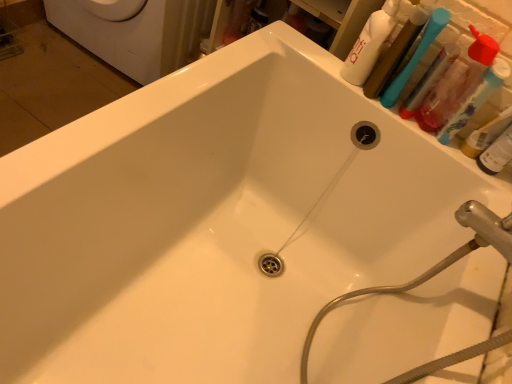
Image resolution: width=512 pixels, height=384 pixels. Describe the element at coordinates (496, 154) in the screenshot. I see `translucent plastic bottle at upper right` at that location.

Measure the distance between translucent plastic bottle at upper right and camera.

translucent plastic bottle at upper right and camera are 34.65 inches apart.

Describe the element at coordinates (369, 44) in the screenshot. I see `white glossy bottle at upper right` at that location.

This screenshot has width=512, height=384. Find the location of `white glossy washing machine at upper left`. white glossy washing machine at upper left is located at coordinates (136, 32).

Identify the location of translucent plastic bottle at upper right. This screenshot has width=512, height=384. (496, 154).

Consider the image. Is blue plastic toothbrush at upper right, which is the 1th toothbrush from right to left, touching brushed metal hose at upper right?

No, blue plastic toothbrush at upper right, which is the 1th toothbrush from right to left, is not next to brushed metal hose at upper right.

How much distance is there between blue plastic toothbrush at upper right, which is the 1th toothbrush from right to left, and brushed metal hose at upper right?

blue plastic toothbrush at upper right, which is the 1th toothbrush from right to left, is 15.20 inches away from brushed metal hose at upper right.

Could you tell me if blue plastic toothbrush at upper right, which is the 1th toothbrush from right to left, is facing brushed metal hose at upper right?

No, blue plastic toothbrush at upper right, which is the 1th toothbrush from right to left, is not aimed at brushed metal hose at upper right.

Can you confirm if blue plastic toothbrush at upper right, which ranks as the 2th toothbrush in left-to-right order, is thinner than brushed metal hose at upper right?

Yes, blue plastic toothbrush at upper right, which ranks as the 2th toothbrush in left-to-right order, is thinner than brushed metal hose at upper right.

Where is `plumbing fixture below the translucent plastic bottle at upper right (from the image's perspective)`? The width and height of the screenshot is (512, 384). plumbing fixture below the translucent plastic bottle at upper right (from the image's perspective) is located at coordinates (434, 265).

From the image's perspective, is brushed metal hose at upper right located above or below translucent plastic bottle at upper right?

brushed metal hose at upper right is situated lower than translucent plastic bottle at upper right in the image.

Is translucent plastic bottle at upper right located within brushed metal hose at upper right?

No.

How different are the orientations of blue plastic toothbrush at upper right, which is the 1th toothbrush from right to left, and translucent plastic bottle at upper right in degrees?

There is a 0.00182-degree angle between the facing directions of blue plastic toothbrush at upper right, which is the 1th toothbrush from right to left, and translucent plastic bottle at upper right.

From a real-world perspective, which is physically above, blue plastic toothbrush at upper right, which ranks as the 2th toothbrush in left-to-right order, or translucent plastic bottle at upper right?

blue plastic toothbrush at upper right, which ranks as the 2th toothbrush in left-to-right order, from a real-world perspective.

From the image's perspective, is blue plastic toothbrush at upper right, which is the 1th toothbrush from right to left, below translucent plastic bottle at upper right?

No, from the image's perspective, blue plastic toothbrush at upper right, which is the 1th toothbrush from right to left, is not below translucent plastic bottle at upper right.

Consider the image. Which point is more distant from viewer, (447,136) or (496,169)?

The point (447,136) is behind.

Considering the relative sizes of blue plastic toothbrush at upper right, which ranks as the 2th toothbrush in left-to-right order, and white glossy bottle at upper right in the image provided, is blue plastic toothbrush at upper right, which ranks as the 2th toothbrush in left-to-right order, shorter than white glossy bottle at upper right?

Indeed, blue plastic toothbrush at upper right, which ranks as the 2th toothbrush in left-to-right order, has a lesser height compared to white glossy bottle at upper right.

Based on the photo, from the image's perspective, which is above, blue plastic toothbrush at upper right, which ranks as the 2th toothbrush in left-to-right order, or white glossy bottle at upper right?

white glossy bottle at upper right is shown above in the image.

Between blue plastic toothbrush at upper right, which ranks as the 2th toothbrush in left-to-right order, and white glossy bottle at upper right, which one is positioned behind?

white glossy bottle at upper right is further from the camera.

Is white glossy bottle at upper right inside blue plastic toothbrush at upper right, which is the 1th toothbrush from right to left?

No, white glossy bottle at upper right is located outside of blue plastic toothbrush at upper right, which is the 1th toothbrush from right to left.

Is blue plastic toothbrush at upper right, which is the 1th toothbrush from right to left, bigger or smaller than white glossy washing machine at upper left?

blue plastic toothbrush at upper right, which is the 1th toothbrush from right to left, is smaller than white glossy washing machine at upper left.

From a real-world perspective, who is located higher, blue plastic toothbrush at upper right, which is the 1th toothbrush from right to left, or white glossy washing machine at upper left?

blue plastic toothbrush at upper right, which is the 1th toothbrush from right to left, is physically above.

Looking at this image, is blue plastic toothbrush at upper right, which ranks as the 2th toothbrush in left-to-right order, further to the viewer compared to white glossy washing machine at upper left?

No, it is in front of white glossy washing machine at upper left.

Which object is positioned more to the right, white glossy washing machine at upper left or translucent plastic bottle at upper right?

translucent plastic bottle at upper right.

Is white glossy washing machine at upper left facing away from translucent plastic bottle at upper right?

white glossy washing machine at upper left is not turned away from translucent plastic bottle at upper right.

Looking at their sizes, would you say white glossy washing machine at upper left is wider or thinner than translucent plastic bottle at upper right?

white glossy washing machine at upper left is wider than translucent plastic bottle at upper right.

Measure the distance from white glossy washing machine at upper left to translucent plastic bottle at upper right.

1.26 meters.

Starting from the brushed metal hose at upper right, which toothbrush is the 1st one behind? Please provide its 2D coordinates.

[(416, 56)]

Is point (441, 262) positioned in front of point (422, 45)?

Yes, point (441, 262) is closer to viewer.

Visually, is brushed metal hose at upper right positioned to the left or to the right of blue plastic toothbrush at upper right, which appears as the 2th toothbrush when viewed from the right?

Clearly, brushed metal hose at upper right is on the left of blue plastic toothbrush at upper right, which appears as the 2th toothbrush when viewed from the right, in the image.

Does brushed metal hose at upper right have a lesser height compared to blue plastic toothbrush at upper right, placed as the 1th toothbrush when sorted from left to right?

Incorrect, the height of brushed metal hose at upper right does not fall short of that of blue plastic toothbrush at upper right, placed as the 1th toothbrush when sorted from left to right.

Where is `plumbing fixture that is in front of the blue plastic toothbrush at upper right, which is the 1th toothbrush from right to left`? The image size is (512, 384). plumbing fixture that is in front of the blue plastic toothbrush at upper right, which is the 1th toothbrush from right to left is located at coordinates (434, 265).

At what (x,y) coordinates should I click in order to perform the action: click on toiletry on the right of brushed metal hose at upper right. Please return your answer as a coordinate pair (x, y). The width and height of the screenshot is (512, 384). Looking at the image, I should click on (496, 154).

Looking at this image, based on their spatial positions, is blue plastic toothbrush at upper right, which appears as the 2th toothbrush when viewed from the right, or translucent plastic bottle at upper right closer to white glossy bottle at upper right?

blue plastic toothbrush at upper right, which appears as the 2th toothbrush when viewed from the right, lies closer to white glossy bottle at upper right than the other object.

Which object lies nearer to the anchor point white glossy bottle at upper right, white glossy washing machine at upper left or brushed metal hose at upper right?

brushed metal hose at upper right.

From the image, which object appears to be nearer to blue plastic toothbrush at upper right, which ranks as the 2th toothbrush in left-to-right order, translucent plastic bottle at upper right or brushed metal hose at upper right?

translucent plastic bottle at upper right.

Based on their spatial positions, is translucent plastic bottle at upper right or blue plastic toothbrush at upper right, which ranks as the 2th toothbrush in left-to-right order, closer to brushed metal hose at upper right?

Among the two, translucent plastic bottle at upper right is located nearer to brushed metal hose at upper right.

Looking at the image, which one is located closer to blue plastic toothbrush at upper right, placed as the 1th toothbrush when sorted from left to right, white glossy bottle at upper right or translucent plastic bottle at upper right?

white glossy bottle at upper right is positioned closer to the anchor blue plastic toothbrush at upper right, placed as the 1th toothbrush when sorted from left to right.

Which object lies further to the anchor point white glossy bottle at upper right, translucent plastic bottle at upper right or blue plastic toothbrush at upper right, placed as the 1th toothbrush when sorted from left to right?

translucent plastic bottle at upper right.

Based on their spatial positions, is brushed metal hose at upper right or blue plastic toothbrush at upper right, which appears as the 2th toothbrush when viewed from the right, closer to white glossy washing machine at upper left?

blue plastic toothbrush at upper right, which appears as the 2th toothbrush when viewed from the right, is positioned closer to the anchor white glossy washing machine at upper left.

Based on their spatial positions, is white glossy bottle at upper right or blue plastic toothbrush at upper right, which ranks as the 2th toothbrush in left-to-right order, further from white glossy washing machine at upper left?

blue plastic toothbrush at upper right, which ranks as the 2th toothbrush in left-to-right order, lies further to white glossy washing machine at upper left than the other object.

Where is `toiletry between brushed metal hose at upper right and blue plastic toothbrush at upper right, which ranks as the 2th toothbrush in left-to-right order, in the front-back direction`? toiletry between brushed metal hose at upper right and blue plastic toothbrush at upper right, which ranks as the 2th toothbrush in left-to-right order, in the front-back direction is located at coordinates (496, 154).

Locate an element on the screen. cleaning product situated between white glossy washing machine at upper left and blue plastic toothbrush at upper right, which ranks as the 2th toothbrush in left-to-right order, from left to right is located at coordinates click(369, 44).

Find the location of a particular element. The image size is (512, 384). cleaning product between white glossy washing machine at upper left and brushed metal hose at upper right in the vertical direction is located at coordinates (369, 44).

In order to click on plumbing fixture situated between white glossy washing machine at upper left and translucent plastic bottle at upper right from left to right in this screenshot , I will do `click(434, 265)`.